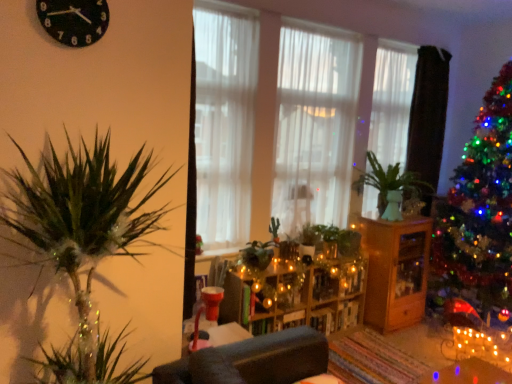
Where is `empty space that is ontop of white sheer curtain at center, which ranks as the second curtain in left-to-right order (from a real-world perspective)`? The height and width of the screenshot is (384, 512). empty space that is ontop of white sheer curtain at center, which ranks as the second curtain in left-to-right order (from a real-world perspective) is located at coordinates (319, 26).